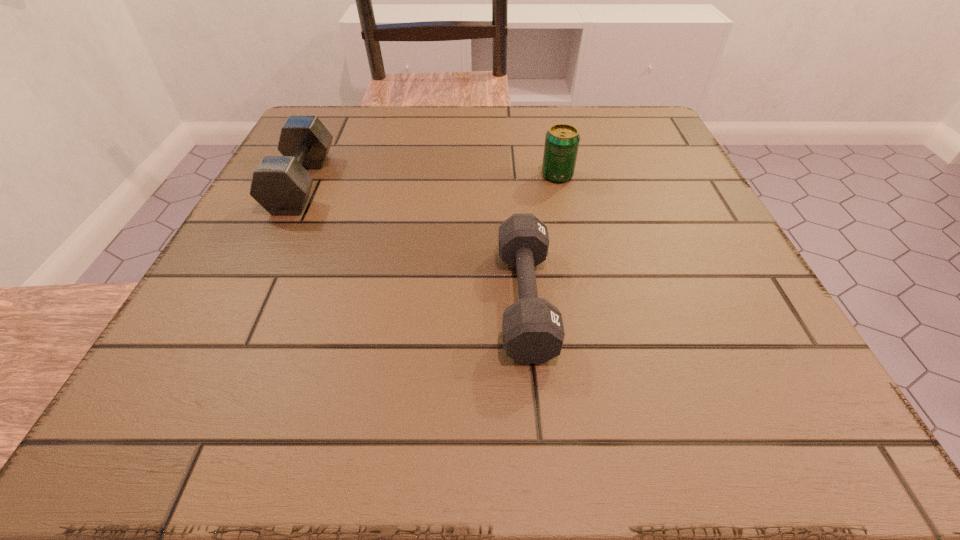
You are a GUI agent. You are given a task and a screenshot of the screen. Output one action in this format:
    pyautogui.click(x=<x>, y=<y>)
    Task: Click on the empty location between the beer can and the taller dumbbell
    
    Given the screenshot: What is the action you would take?
    pyautogui.click(x=429, y=179)

Where is `free spot between the nearest object and the leftmost object`? free spot between the nearest object and the leftmost object is located at coordinates (414, 242).

Image resolution: width=960 pixels, height=540 pixels. I want to click on free space between the beer can and the farther dumbbell, so click(x=429, y=179).

At what (x,y) coordinates should I click in order to perform the action: click on vacant space that is in between the right dumbbell and the farther dumbbell. Please return your answer as a coordinate pair (x, y). Looking at the image, I should click on (x=414, y=242).

Identify which object is the nearest to the left dumbbell. Please provide its 2D coordinates. Your answer should be formatted as a tuple, i.e. [(x, y)], where the tuple contains the x and y coordinates of a point satisfying the conditions above.

[(532, 328)]

Point out which object is positioned as the second nearest to the farther dumbbell. Please provide its 2D coordinates. Your answer should be formatted as a tuple, i.e. [(x, y)], where the tuple contains the x and y coordinates of a point satisfying the conditions above.

[(562, 141)]

Identify the location of vacant space that satisfies the following two spatial constraints: 1. on the front side of the farther dumbbell; 2. on the left side of the shorter dumbbell. click(245, 300).

Where is `free region that satisfies the following two spatial constraints: 1. on the back side of the taller dumbbell; 2. on the right side of the beer can`? free region that satisfies the following two spatial constraints: 1. on the back side of the taller dumbbell; 2. on the right side of the beer can is located at coordinates (305, 176).